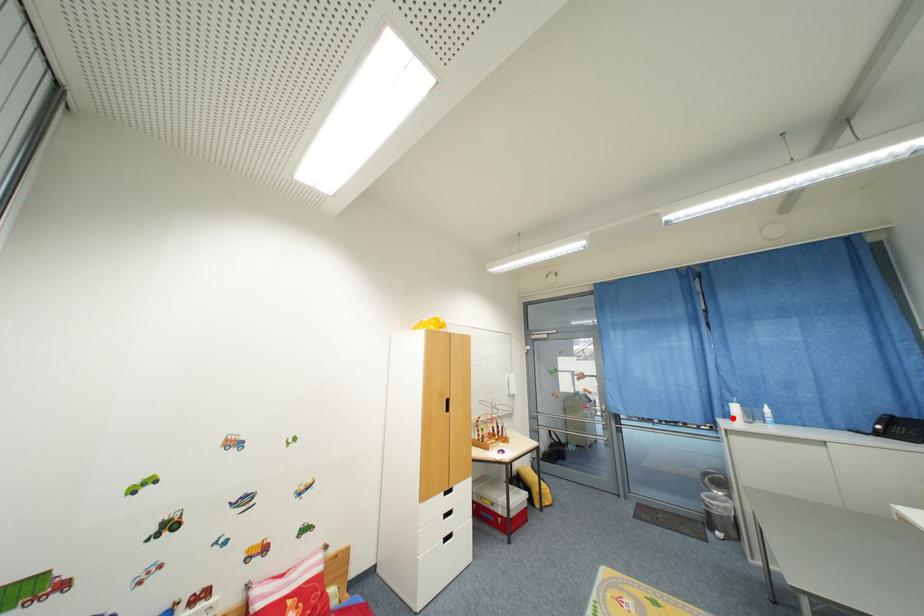
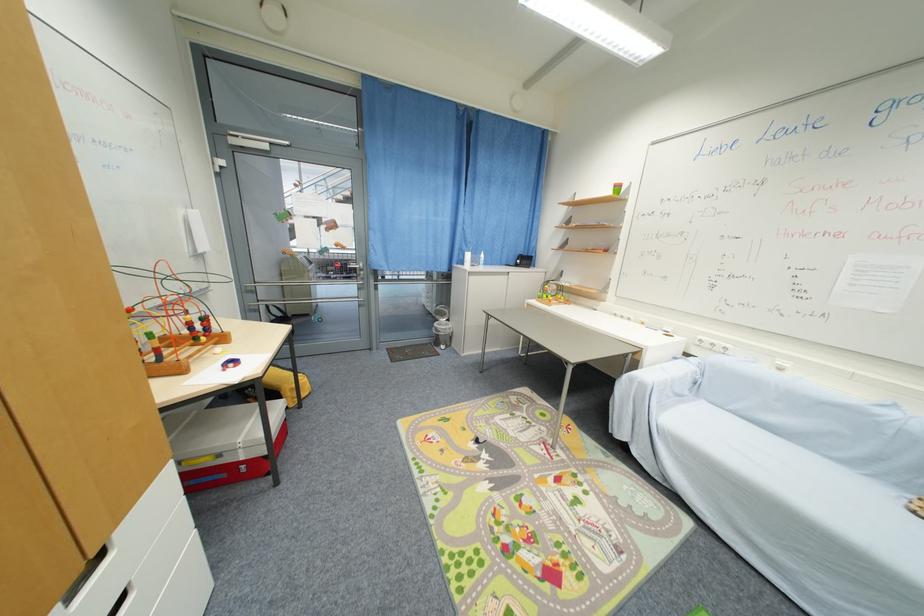
Locate, in the second image, the point that corresponds to the highlighted location in the first image.

(467, 264)